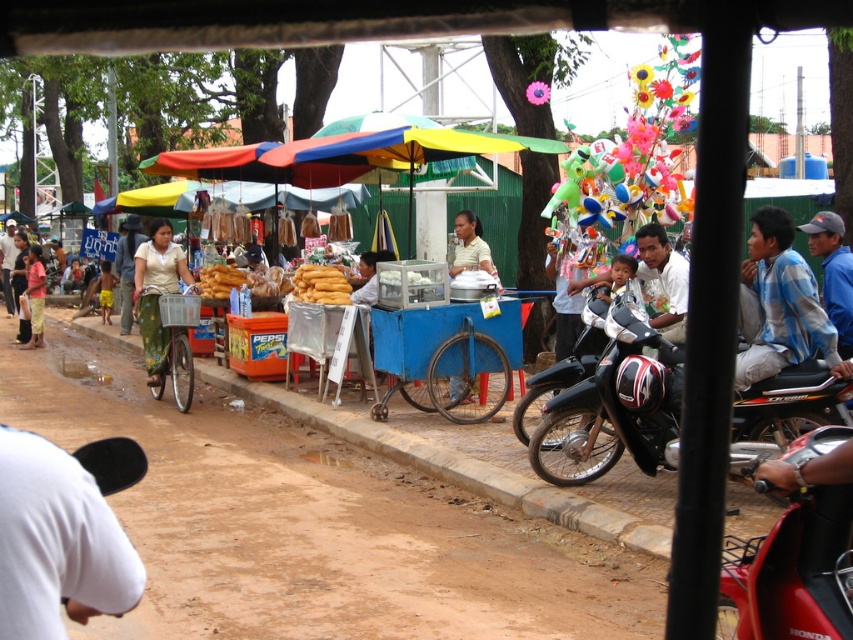
Question: Among these objects, which one is farthest from the camera?

Choices:
 (A) blue fabric cap at upper right
 (B) light brown fabric shirt at center
 (C) light brown wooden stick at left

Answer: (C)

Question: Considering the relative positions of light brown fabric shirt at center and light beige skirt at lower left in the image provided, where is light brown fabric shirt at center located with respect to light beige skirt at lower left?

Choices:
 (A) below
 (B) above

Answer: (B)

Question: Is black matte motorcycle at right to the right of green woven skirt at center from the viewer's perspective?

Choices:
 (A) no
 (B) yes

Answer: (B)

Question: Which object is closer to the camera taking this photo?

Choices:
 (A) blue fabric cap at upper right
 (B) light brown fabric shirt at center
 (C) white matte shirt at center

Answer: (A)

Question: Which point is closer to the camera taking this photo?

Choices:
 (A) (665, 417)
 (B) (741, 278)

Answer: (A)

Question: Can you confirm if black matte motorcycle at right is smaller than light brown fabric shirt at center?

Choices:
 (A) no
 (B) yes

Answer: (B)